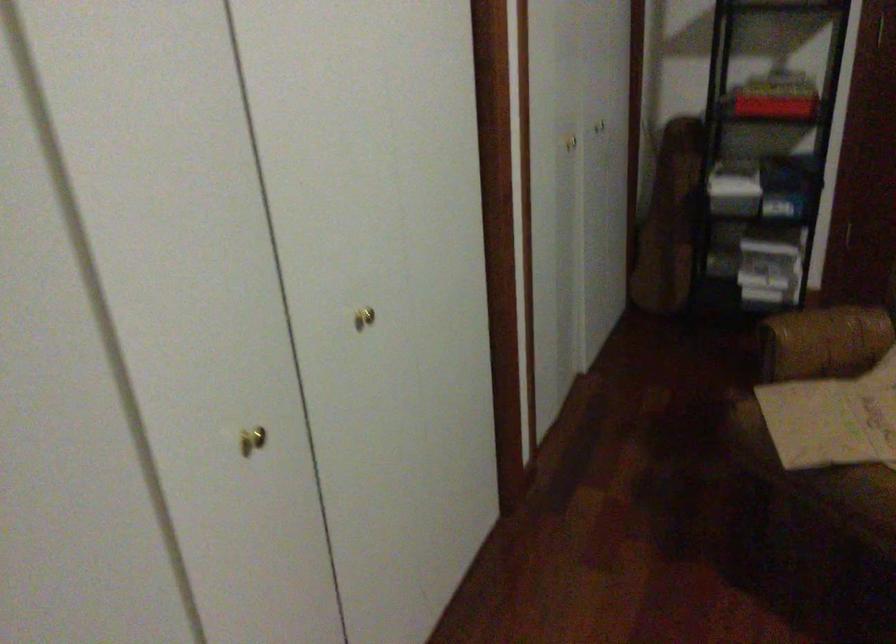
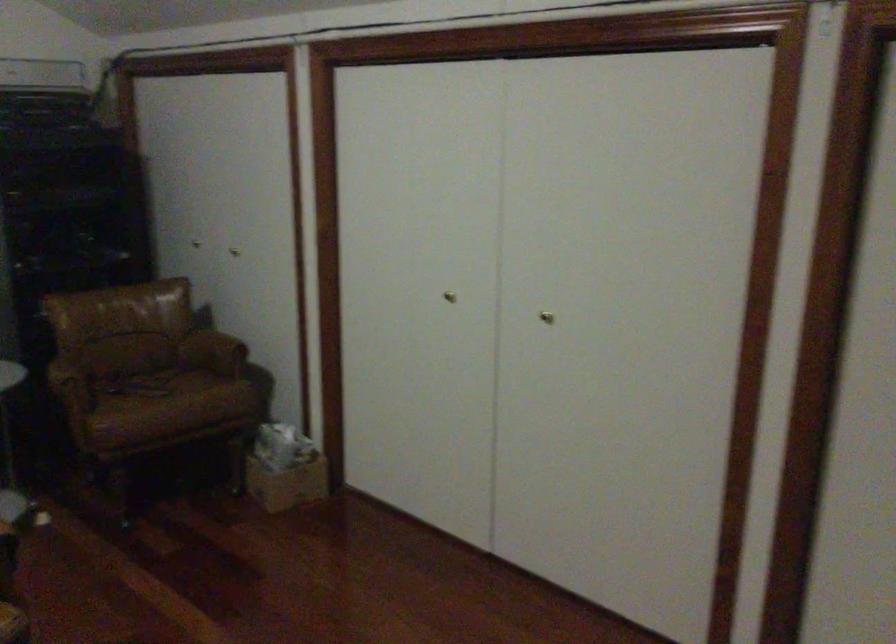
Question: The images are taken continuously from a first-person perspective. In which direction is your viewpoint rotating?

Choices:
 (A) Left
 (B) Right
 (C) Up
 (D) Down

Answer: (B)